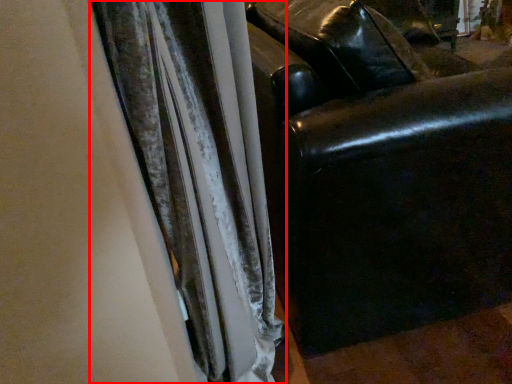
Question: Where is curtain (annotated by the red box) located in relation to furniture in the image?

Choices:
 (A) left
 (B) right

Answer: (A)